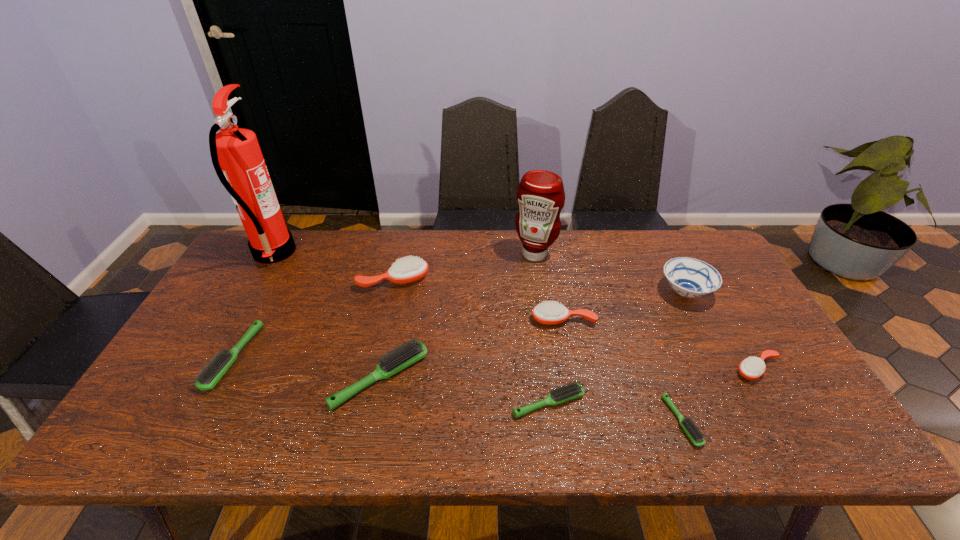
Find the location of a particular element. This screenshot has width=960, height=540. free point that satisfies the following two spatial constraints: 1. with the nozzle aimed from the tallest object; 2. on the right side of the farthest hairbrush is located at coordinates (258, 280).

The image size is (960, 540). I want to click on vacant region that satisfies the following two spatial constraints: 1. on the back side of the blue soup bowl; 2. on the right side of the sixth hairbrush from left to right, so tap(633, 292).

Where is `vacant position in the image that satisfies the following two spatial constraints: 1. with the nozzle aimed from the fire extinguisher; 2. on the left side of the blue soup bowl`? The width and height of the screenshot is (960, 540). vacant position in the image that satisfies the following two spatial constraints: 1. with the nozzle aimed from the fire extinguisher; 2. on the left side of the blue soup bowl is located at coordinates (251, 292).

Locate an element on the screen. free location that satisfies the following two spatial constraints: 1. with the nozzle aimed from the condiment; 2. on the left side of the fire extinguisher is located at coordinates pyautogui.click(x=273, y=254).